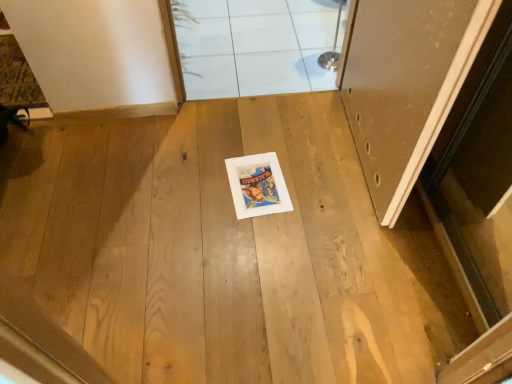
I want to click on blank area to the left of matte white door at right, so click(x=261, y=165).